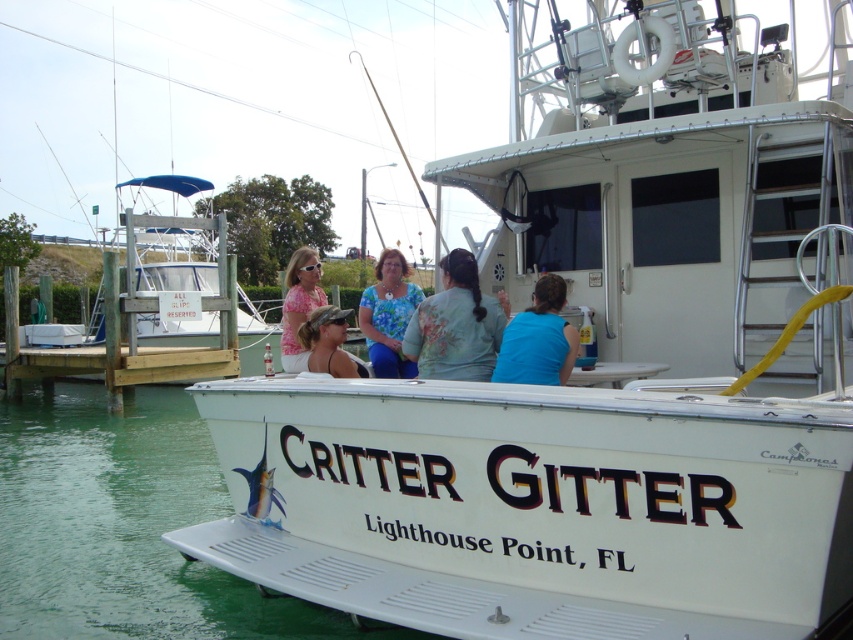
Question: Which of the following is the farthest from the observer?

Choices:
 (A) clear water at boat front
 (B) brown wooden dock at lower left
 (C) blue floral shirt at center

Answer: (B)

Question: Is the position of brown wooden dock at lower left more distant than that of pink fabric shirt at center?

Choices:
 (A) yes
 (B) no

Answer: (A)

Question: Which is nearer to the matte black cap at center?

Choices:
 (A) blue floral shirt at center
 (B) blue fabric shirt at center
 (C) brown wooden dock at lower left

Answer: (A)

Question: Which object is farther from the camera taking this photo?

Choices:
 (A) floral fabric shirt at center
 (B) blue floral shirt at center
 (C) blue fabric shirt at center

Answer: (B)

Question: Is clear water at boat front thinner than pink fabric shirt at center?

Choices:
 (A) no
 (B) yes

Answer: (A)

Question: Does blue floral shirt at center have a lesser width compared to pink fabric shirt at center?

Choices:
 (A) yes
 (B) no

Answer: (A)